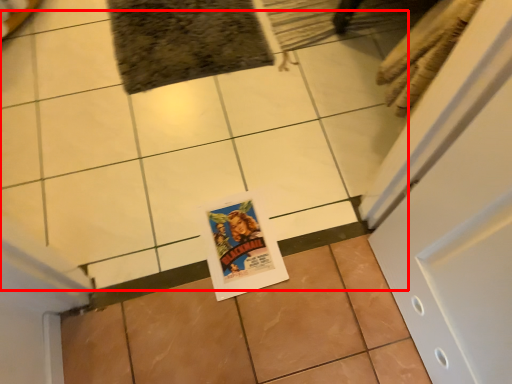
Question: From the image's perspective, where is ceramic tile (annotated by the red box) located in relation to ceramic tile in the image?

Choices:
 (A) below
 (B) above

Answer: (B)